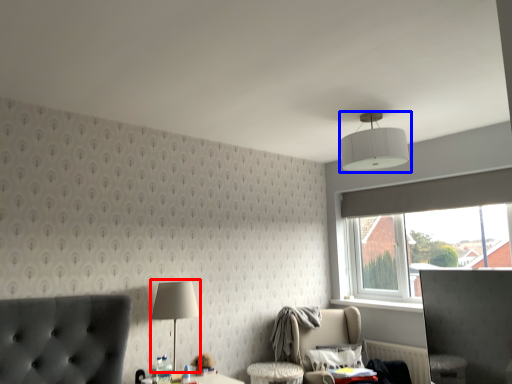
Question: Which point is further to the camera, table lamp (highlighted by a red box) or lamp (highlighted by a blue box)?

Choices:
 (A) table lamp
 (B) lamp

Answer: (A)